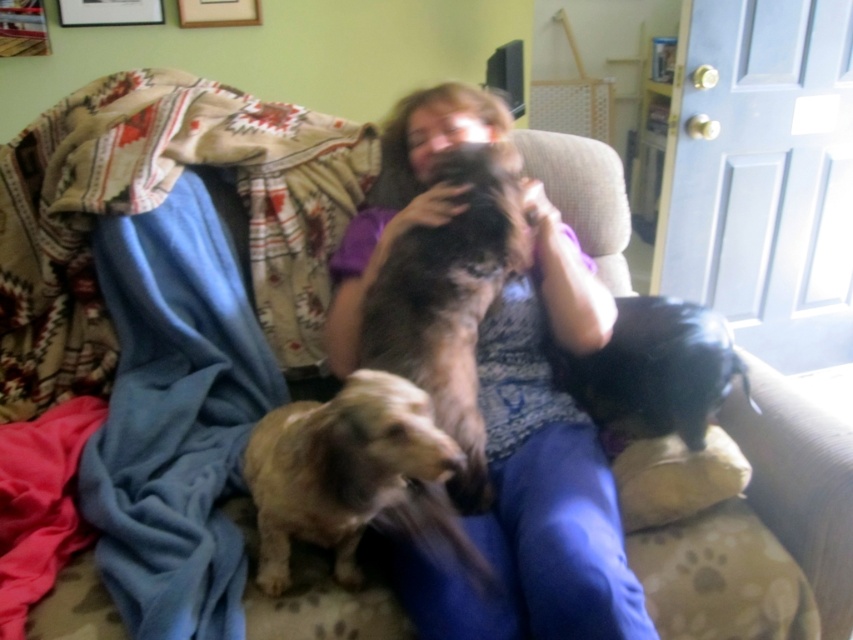
Is brown fuzzy dog at center shorter than black leather dog at lower right?

In fact, brown fuzzy dog at center may be taller than black leather dog at lower right.

Can you confirm if brown fuzzy dog at center is positioned above black leather dog at lower right?

Yes.

Locate an element on the screen. This screenshot has width=853, height=640. brown fuzzy dog at center is located at coordinates (448, 304).

Which is more to the left, brown fur dog at center or black leather dog at lower right?

From the viewer's perspective, brown fur dog at center appears more on the left side.

Is the position of brown fur dog at center more distant than that of black leather dog at lower right?

No, brown fur dog at center is closer to the viewer.

Image resolution: width=853 pixels, height=640 pixels. What do you see at coordinates (355, 477) in the screenshot?
I see `brown fur dog at center` at bounding box center [355, 477].

Find the location of a particular element. This screenshot has width=853, height=640. brown fur dog at center is located at coordinates (355, 477).

Is matte brown dog at center to the right of brown fuzzy dog at center from the viewer's perspective?

Yes, matte brown dog at center is to the right of brown fuzzy dog at center.

Does point (334, 324) come in front of point (503, 257)?

No.

What do you see at coordinates (537, 472) in the screenshot?
I see `matte brown dog at center` at bounding box center [537, 472].

This screenshot has height=640, width=853. I want to click on matte brown dog at center, so click(x=537, y=472).